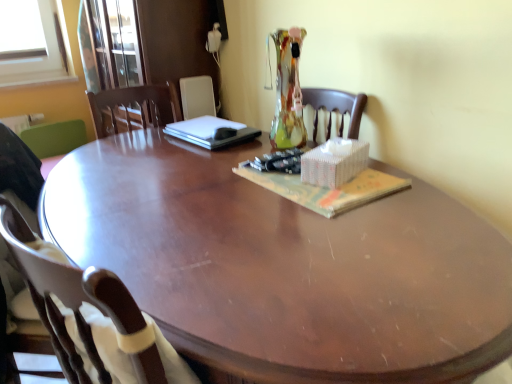
Question: Is matte paper magazine at center next to sleek black laptop at center?

Choices:
 (A) no
 (B) yes

Answer: (A)

Question: Could you tell me if matte paper magazine at center is facing sleek black laptop at center?

Choices:
 (A) yes
 (B) no

Answer: (B)

Question: Is matte paper magazine at center at the left side of sleek black laptop at center?

Choices:
 (A) no
 (B) yes

Answer: (A)

Question: Is matte paper magazine at center positioned with its back to sleek black laptop at center?

Choices:
 (A) yes
 (B) no

Answer: (B)

Question: Can you confirm if matte paper magazine at center is smaller than sleek black laptop at center?

Choices:
 (A) yes
 (B) no

Answer: (A)

Question: Considering the positions of brown wood chair at lower left, positioned as the second chair in front-to-back order, and matte paper magazine at center in the image, is brown wood chair at lower left, positioned as the second chair in front-to-back order, taller or shorter than matte paper magazine at center?

Choices:
 (A) tall
 (B) short

Answer: (A)

Question: In terms of size, does brown wood chair at lower left, positioned as the second chair in front-to-back order, appear bigger or smaller than matte paper magazine at center?

Choices:
 (A) big
 (B) small

Answer: (A)

Question: Is point (154, 329) closer or farther from the camera than point (244, 163)?

Choices:
 (A) farther
 (B) closer

Answer: (B)

Question: From the image's perspective, is brown wood chair at lower left, the second chair in the back-to-front sequence, above or below matte paper magazine at center?

Choices:
 (A) below
 (B) above

Answer: (A)

Question: From a real-world perspective, relative to brown wood chair at lower left, marked as the 3th chair in a back-to-front arrangement, is sleek black laptop at center vertically above or below?

Choices:
 (A) below
 (B) above

Answer: (B)

Question: Do you think sleek black laptop at center is within brown wood chair at lower left, marked as the 3th chair in a back-to-front arrangement, or outside of it?

Choices:
 (A) outside
 (B) inside

Answer: (A)

Question: Considering the positions of sleek black laptop at center and brown wood chair at lower left, marked as the 3th chair in a back-to-front arrangement, in the image, is sleek black laptop at center taller or shorter than brown wood chair at lower left, marked as the 3th chair in a back-to-front arrangement,?

Choices:
 (A) short
 (B) tall

Answer: (A)

Question: In the image, is sleek black laptop at center on the left side or the right side of brown wood chair at lower left, the first chair in the front-to-back sequence?

Choices:
 (A) left
 (B) right

Answer: (B)

Question: Is brown wood chair at lower left, positioned as the second chair in front-to-back order, situated inside brown wood chair at lower left, marked as the 3th chair in a back-to-front arrangement, or outside?

Choices:
 (A) inside
 (B) outside

Answer: (A)

Question: From a real-world perspective, is brown wood chair at lower left, the second chair in the back-to-front sequence, physically located above or below brown wood chair at lower left, the first chair in the front-to-back sequence?

Choices:
 (A) below
 (B) above

Answer: (A)